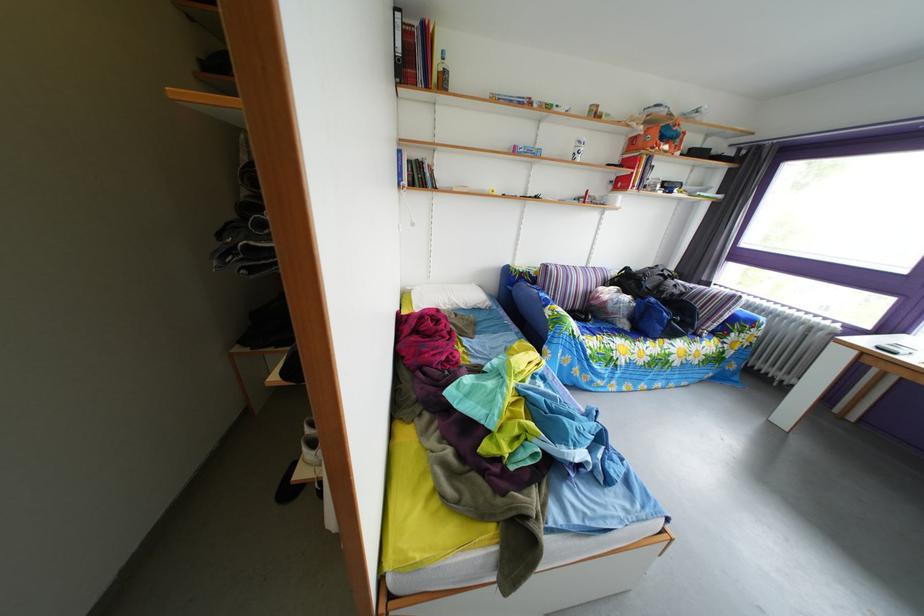
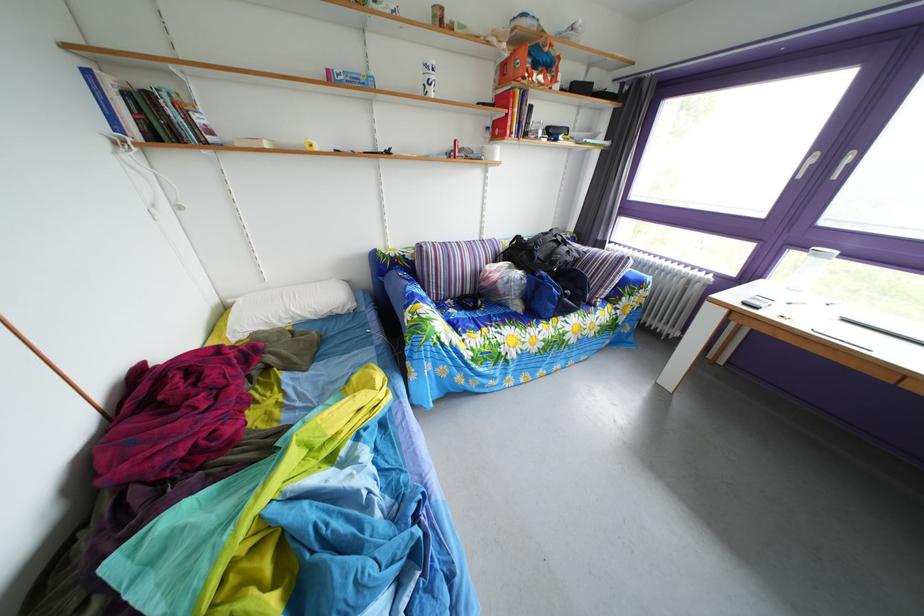
Where in the second image is the point corresponding to point 663,307 from the first image?

(553, 282)